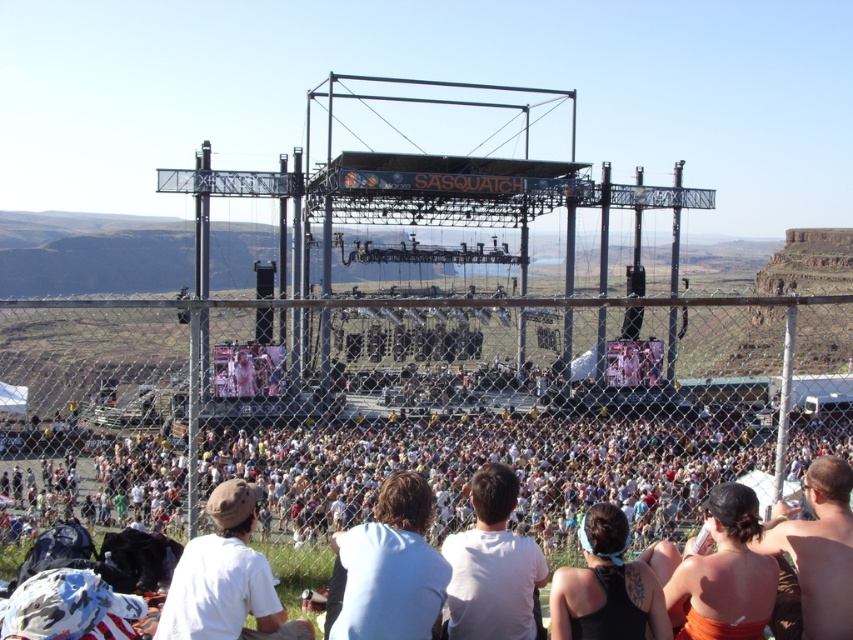
In the scene shown: You are a photographer at the Sasquatch Music Festival. You notice two attendees in the crowd. One is wearing a white cotton shirt at lower center, and the other is wearing a skinny bikini top at lower right. Which attendee is closer to the stage?

The white cotton shirt at lower center is positioned under the skinny bikini top at lower right, indicating it is closer to the stage.